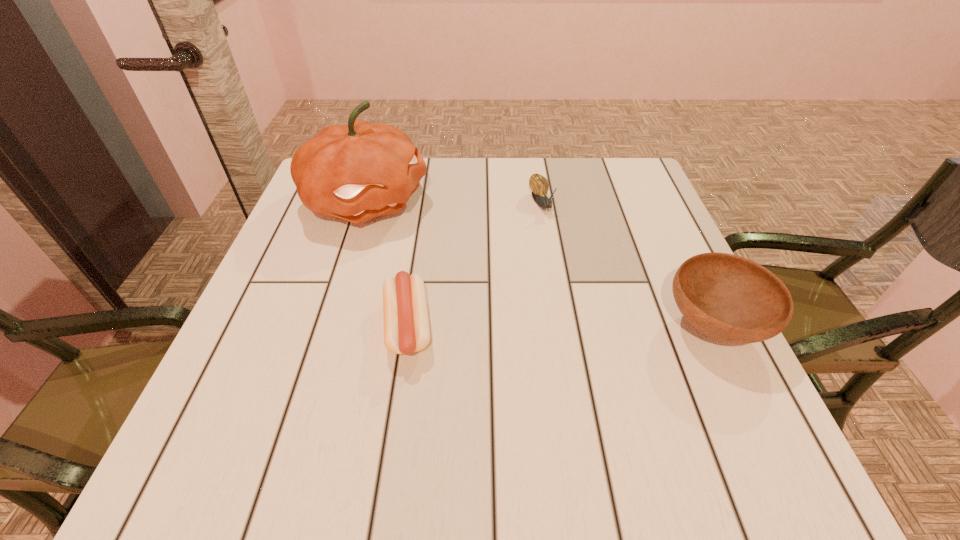
Where is `vacant space on the desktop that is between the sausage and the bowl and is positioned on the front face of the pumpkin`? vacant space on the desktop that is between the sausage and the bowl and is positioned on the front face of the pumpkin is located at coordinates click(x=576, y=326).

Find the location of a particular element. This screenshot has height=540, width=960. free space on the desktop that is between the sausage and the bowl and is positioned on the front-facing side of the third object from left to right is located at coordinates (602, 326).